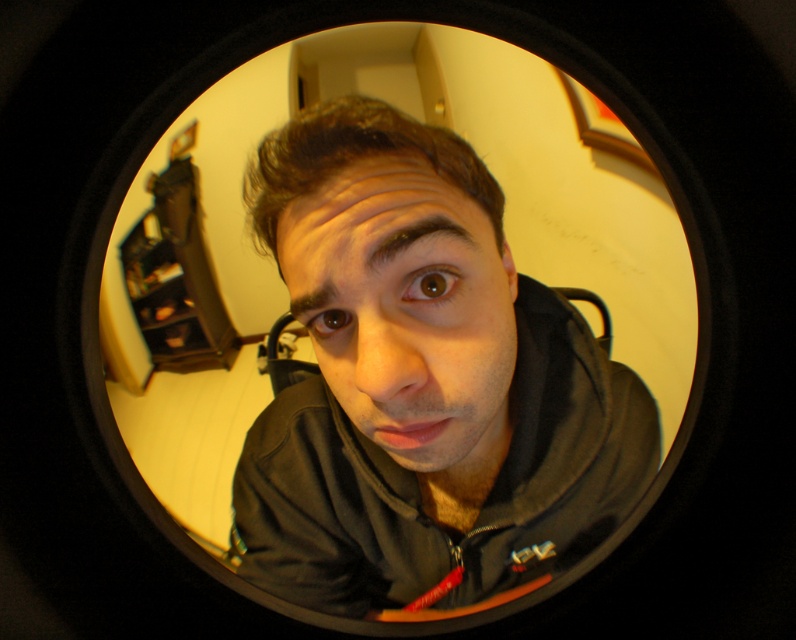
Question: Is matte black hoodie at center smaller than smooth skin face at center?

Choices:
 (A) no
 (B) yes

Answer: (A)

Question: Is the position of matte black hoodie at center less distant than that of smooth skin face at center?

Choices:
 (A) no
 (B) yes

Answer: (B)

Question: Can you confirm if matte black hoodie at center is bigger than smooth skin face at center?

Choices:
 (A) no
 (B) yes

Answer: (B)